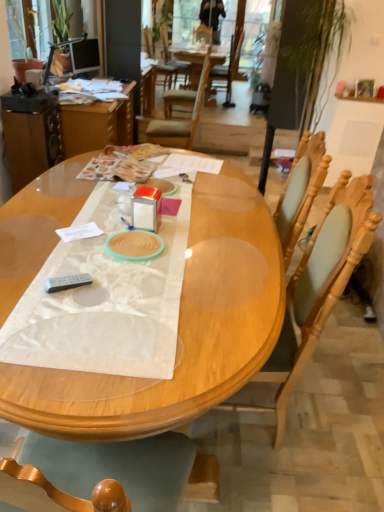
What is the approximate width of green leafy plant at upper left, the second houseplant from the front?

green leafy plant at upper left, the second houseplant from the front, is 8.34 inches in width.

The width and height of the screenshot is (384, 512). What do you see at coordinates (62, 32) in the screenshot?
I see `green leafy plant at upper left, the second houseplant from the front` at bounding box center [62, 32].

Where is `gray matte remote control at lower left`? gray matte remote control at lower left is located at coordinates (67, 282).

What is the approximate height of white satin table runner at center?

white satin table runner at center is 1.48 inches tall.

Locate an element on the screen. This screenshot has width=384, height=512. wooden chair at center, the second chair viewed from the front is located at coordinates (180, 120).

Locate an element on the screen. This screenshot has height=512, width=384. wooden chair at right, placed as the first chair when sorted from bottom to top is located at coordinates (313, 295).

In order to face matte black monitor at upper left, should I rotate leftwards or rightwards?

It's best to rotate left around 14.151 degrees.

Image resolution: width=384 pixels, height=512 pixels. What are the coordinates of `wooden table at left` in the screenshot? It's located at (97, 124).

Identify the location of green leafy plant at upper left, the second houseplant from the front. (62, 32).

Does wooden table at left turn towards white satin table runner at center?

No, wooden table at left is not turned towards white satin table runner at center.

Between wooden table at left and white satin table runner at center, which one has larger width?

With larger width is white satin table runner at center.

Looking at this image, between wooden table at left and white satin table runner at center, which one has smaller size?

Smaller between the two is white satin table runner at center.

Considering the positions of point (74, 108) and point (54, 331), is point (74, 108) closer or farther from the camera than point (54, 331)?

Point (74, 108) is farther from the camera than point (54, 331).

From the picture: Can we say white satin table runner at center lies outside matte black monitor at upper left?

white satin table runner at center lies outside matte black monitor at upper left's area.

In the scene shown: From the image's perspective, which one is positioned higher, white satin table runner at center or matte black monitor at upper left?

From the image's view, matte black monitor at upper left is above.

Who is taller, white satin table runner at center or matte black monitor at upper left?

Standing taller between the two is matte black monitor at upper left.

Can you confirm if gray matte remote control at lower left is bigger than white satin table runner at center?

Incorrect, gray matte remote control at lower left is not larger than white satin table runner at center.

Based on the photo, considering the sizes of objects gray matte remote control at lower left and white satin table runner at center in the image provided, who is wider, gray matte remote control at lower left or white satin table runner at center?

With larger width is white satin table runner at center.

From the picture: Is gray matte remote control at lower left next to white satin table runner at center?

gray matte remote control at lower left and white satin table runner at center are not in contact.

From the image's perspective, would you say gray matte remote control at lower left is shown under white satin table runner at center?

Correct, gray matte remote control at lower left appears lower than white satin table runner at center in the image.

Is wooden chair at right, which is the second chair in top-to-bottom order, directly adjacent to wooden table at left?

wooden chair at right, which is the second chair in top-to-bottom order, is not next to wooden table at left, and they're not touching.

Considering their positions, is wooden chair at right, which is the first chair in front-to-back order, located in front of or behind wooden table at left?

wooden chair at right, which is the first chair in front-to-back order, is in front of wooden table at left.

From a real-world perspective, relative to wooden table at left, is wooden chair at right, which is the second chair in top-to-bottom order, vertically above or below?

From a real-world perspective, wooden chair at right, which is the second chair in top-to-bottom order, is physically above wooden table at left.

Who is taller, wooden chair at right, placed as the first chair when sorted from bottom to top, or wooden table at left?

wooden chair at right, placed as the first chair when sorted from bottom to top.

From the image's perspective, who appears lower, gray matte remote control at lower left or green leafy plant at upper left, the second houseplant from the front?

gray matte remote control at lower left.

In order to click on remote control located below the green leafy plant at upper left, the second houseplant from the front (from the image's perspective) in this screenshot , I will do `click(67, 282)`.

Can you confirm if gray matte remote control at lower left is taller than green leafy plant at upper left, arranged as the first houseplant when viewed from the back?

Incorrect, the height of gray matte remote control at lower left is not larger of that of green leafy plant at upper left, arranged as the first houseplant when viewed from the back.

From a real-world perspective, who is located lower, gray matte remote control at lower left or green leafy plant at upper left, the second houseplant from the front?

gray matte remote control at lower left, from a real-world perspective.

Is the position of wooden table at left more distant than that of wooden table at center?

Yes, it is behind wooden table at center.

Does wooden table at left contain wooden table at center?

Actually, wooden table at center is outside wooden table at left.

Based on the photo, is wooden table at left taller or shorter than wooden table at center?

Considering their sizes, wooden table at left has less height than wooden table at center.

Identify the location of desk that is above the wooden table at left (from a real-world perspective). click(178, 330).

Which object is more forward, green leafy plant at upper left, which ranks as the 2th houseplant in back-to-front order, or white satin table runner at center?

white satin table runner at center is more forward.

Is green leafy plant at upper left, which ranks as the 2th houseplant in back-to-front order, oriented towards white satin table runner at center?

No, green leafy plant at upper left, which ranks as the 2th houseplant in back-to-front order, does not turn towards white satin table runner at center.

What are the coordinates of `the 2nd houseplant located above the white satin table runner at center (from a real-world perspective)` in the screenshot? It's located at (22, 36).

The image size is (384, 512). Identify the location of sheet to the right of wooden table at left. (104, 300).

Where is `television behind the white satin table runner at center`? This screenshot has width=384, height=512. television behind the white satin table runner at center is located at coordinates (85, 55).

From the image, which object appears to be farther from wooden chair at center, which is the second chair from bottom to top, white satin table runner at center or matte black monitor at upper left?

white satin table runner at center.

Looking at the image, which one is located closer to wooden table at center, wooden chair at center, which is the second chair from bottom to top, or green leafy plant at upper left, which is counted as the 1th houseplant, starting from the front?

wooden chair at center, which is the second chair from bottom to top, lies closer to wooden table at center than the other object.

Looking at this image, from the image, which object appears to be nearer to wooden chair at center, which is the first chair from top to bottom, matte black monitor at upper left or wooden table at center?

The object closer to wooden chair at center, which is the first chair from top to bottom, is matte black monitor at upper left.

From the image, which object appears to be farther from white satin table runner at center, green leafy plant at upper left, which ranks as the 2th houseplant in back-to-front order, or wooden chair at right, which is the second chair from back to front?

Among the two, green leafy plant at upper left, which ranks as the 2th houseplant in back-to-front order, is located further to white satin table runner at center.

Looking at the image, which one is located closer to wooden chair at center, which is the second chair from bottom to top, green leafy plant at upper left, arranged as the first houseplant when viewed from the back, or white satin table runner at center?

Among the two, green leafy plant at upper left, arranged as the first houseplant when viewed from the back, is located nearer to wooden chair at center, which is the second chair from bottom to top.

Looking at the image, which one is located further to wooden chair at center, which is the second chair from bottom to top, matte black monitor at upper left or wooden table at left?

The object further to wooden chair at center, which is the second chair from bottom to top, is matte black monitor at upper left.

When comparing their distances from wooden chair at right, placed as the first chair when sorted from bottom to top, does white satin table runner at center or wooden table at center seem closer?

wooden table at center is positioned closer to the anchor wooden chair at right, placed as the first chair when sorted from bottom to top.

Which object lies nearer to the anchor point wooden chair at right, placed as the first chair when sorted from bottom to top, matte black monitor at upper left or white satin table runner at center?

white satin table runner at center is closer to wooden chair at right, placed as the first chair when sorted from bottom to top.

Where is `table located between white satin table runner at center and wooden chair at center, which is the first chair from top to bottom, in the depth direction`? This screenshot has width=384, height=512. table located between white satin table runner at center and wooden chair at center, which is the first chair from top to bottom, in the depth direction is located at coordinates (97, 124).

You are a GUI agent. You are given a task and a screenshot of the screen. Output one action in this format:
    pyautogui.click(x=<x>, y=<y>)
    Task: Click on the table between white satin table runner at center and green leafy plant at upper left, the second houseplant from the front, along the z-axis
    
    Given the screenshot: What is the action you would take?
    pyautogui.click(x=97, y=124)

At what (x,y) coordinates should I click in order to perform the action: click on television between green leafy plant at upper left, the second houseplant from the front, and wooden table at left in the up-down direction. Please return your answer as a coordinate pair (x, y). This screenshot has height=512, width=384. Looking at the image, I should click on (85, 55).

At what (x,y) coordinates should I click in order to perform the action: click on chair between wooden table at center and wooden chair at center, the second chair viewed from the front, along the z-axis. Please return your answer as a coordinate pair (x, y). This screenshot has height=512, width=384. Looking at the image, I should click on (313, 295).